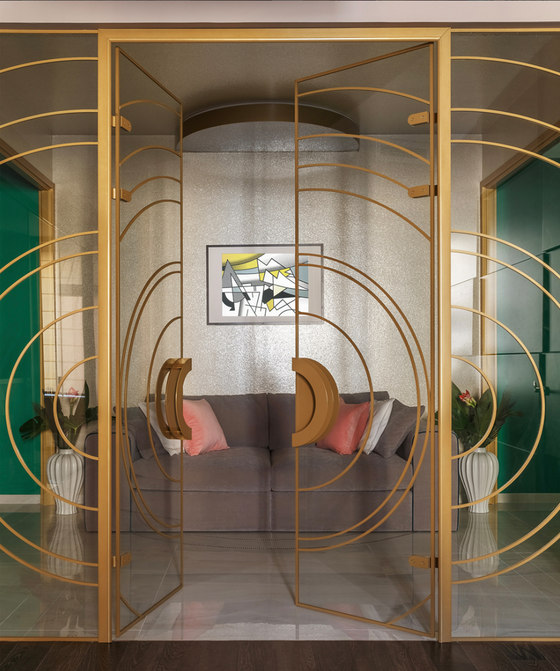
The image size is (560, 671). What are the coordinates of `glass wall` in the screenshot? It's located at (517, 521), (32, 527).